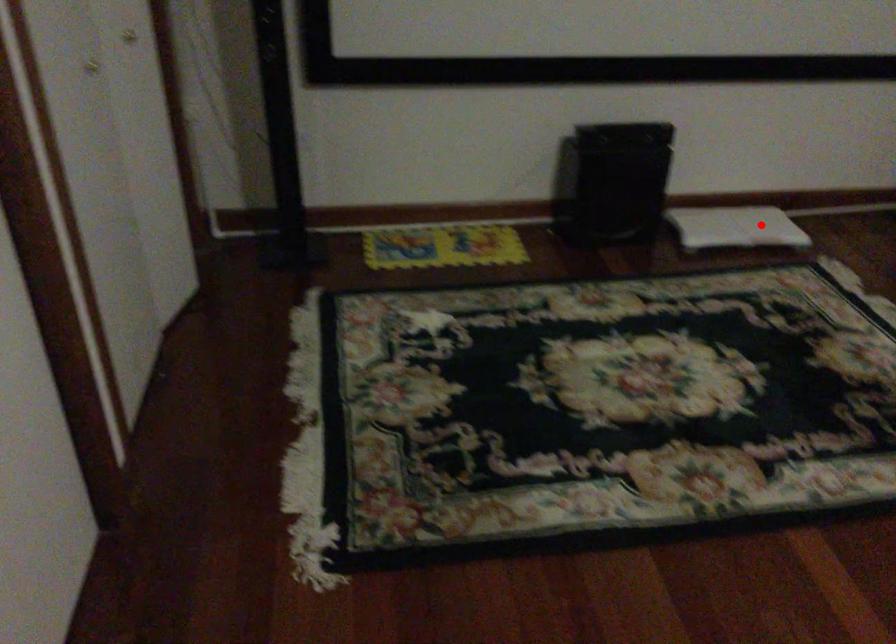
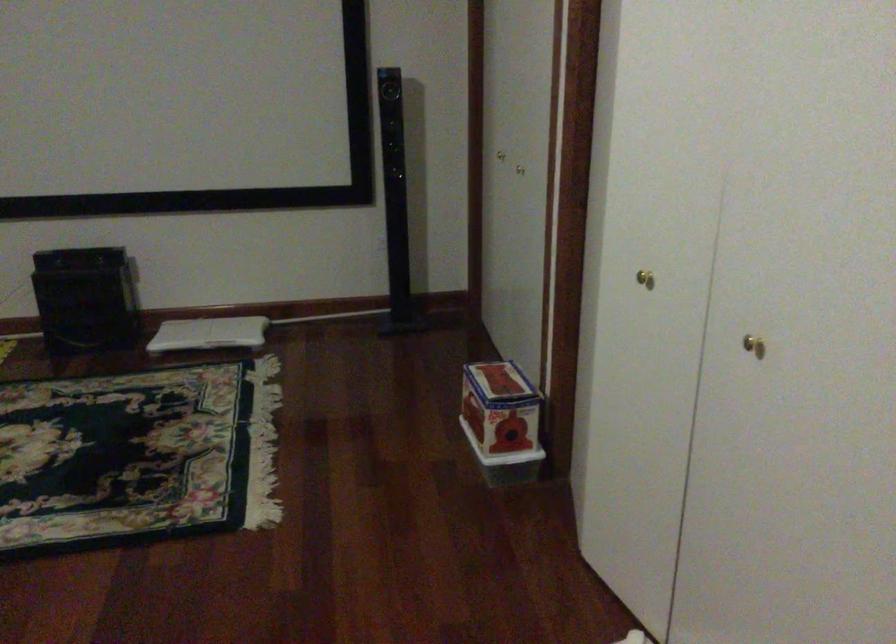
Question: A red point is marked in image1. In image2, is the corresponding 3D point closer to the camera or farther? Reply with the corresponding letter.

Choices:
 (A) The corresponding 3D point is closer.
 (B) The corresponding 3D point is farther.

Answer: (B)